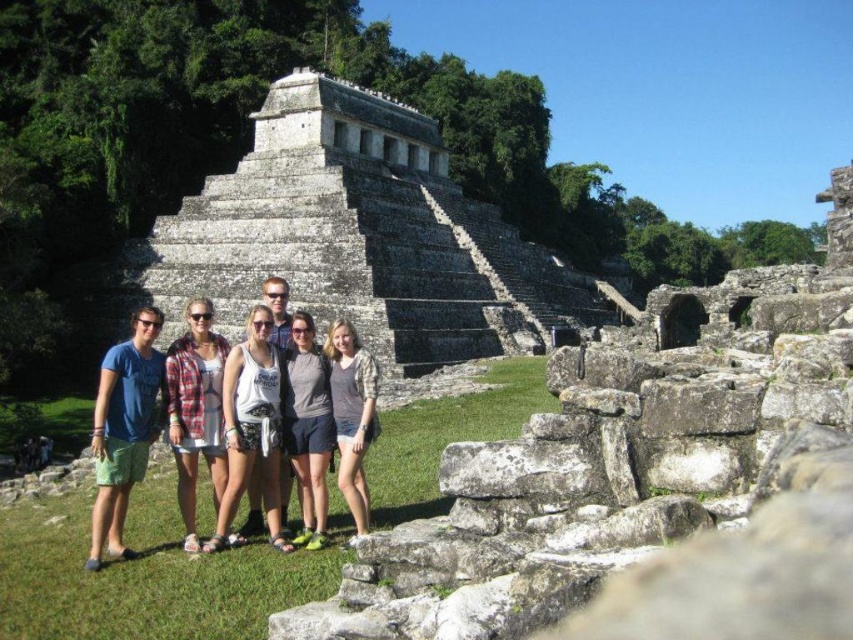
You are a photographer trying to capture a clear shot of both the white cotton tank top at center and the gray cotton shirt at center. Which one will appear closer to the camera in the photo?

The white cotton tank top at center will appear closer to the camera because it is positioned further to the viewer than the gray cotton shirt at center.

You are a photographer trying to adjust the focus of your camera to capture both the plaid fabric shirt at center and the gray cotton shirt at center. Which shirt should you focus on first to ensure both are in focus?

The plaid fabric shirt at center is positioned over the gray cotton shirt at center, so focusing on the plaid fabric shirt at center first will ensure both are in focus as the gray cotton shirt is behind it.